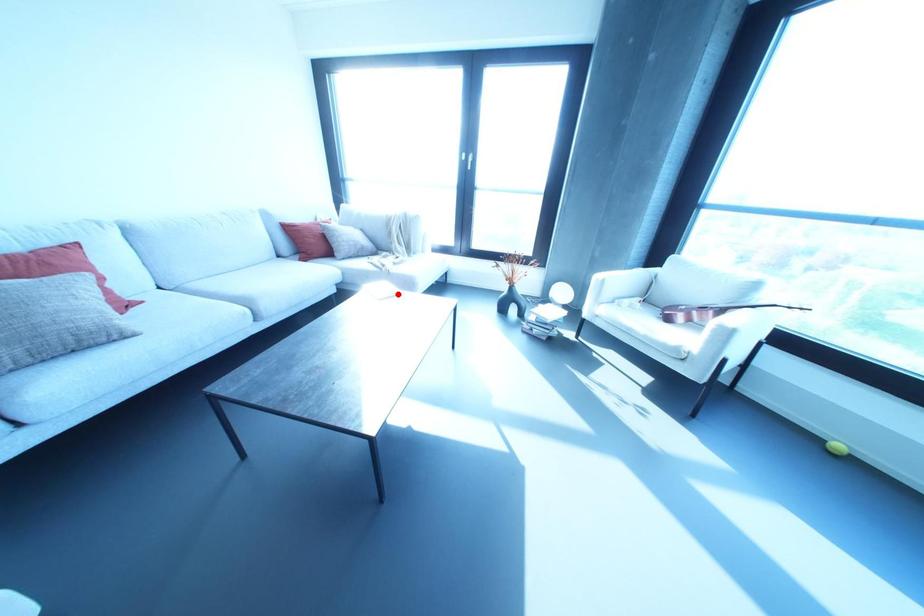
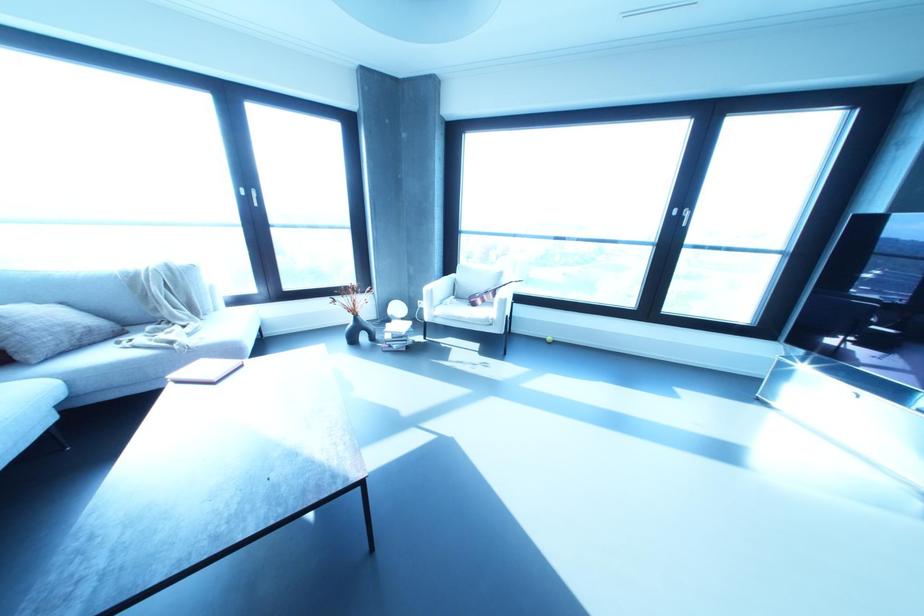
Find the pixel in the second image that matches the highlighted location in the first image.

(241, 365)